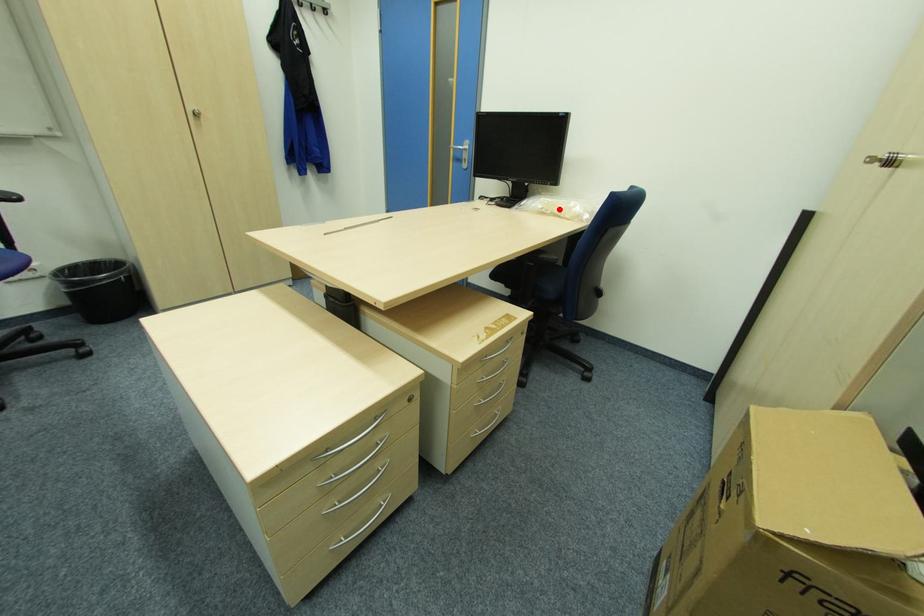
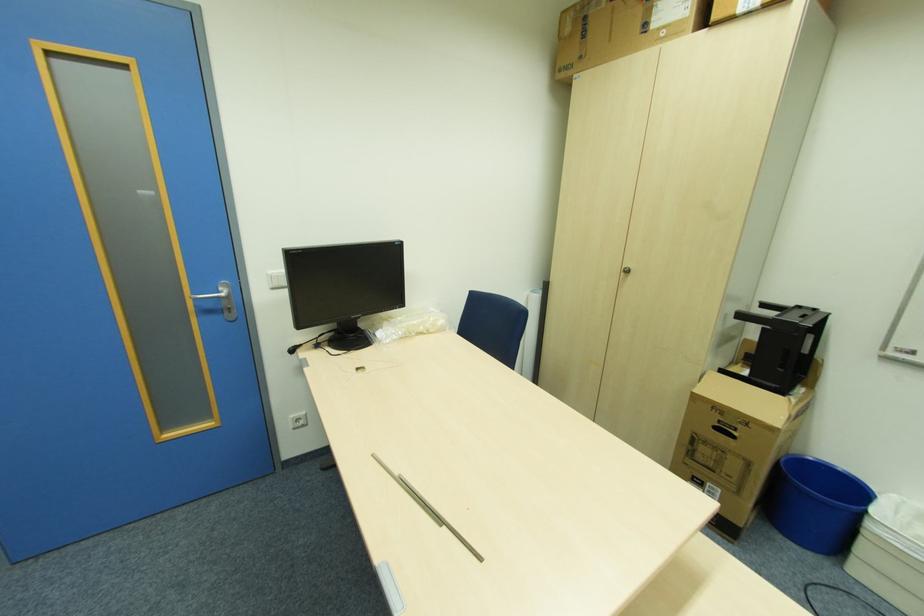
Find the pixel in the second image that matches the highlighted location in the first image.

(424, 329)